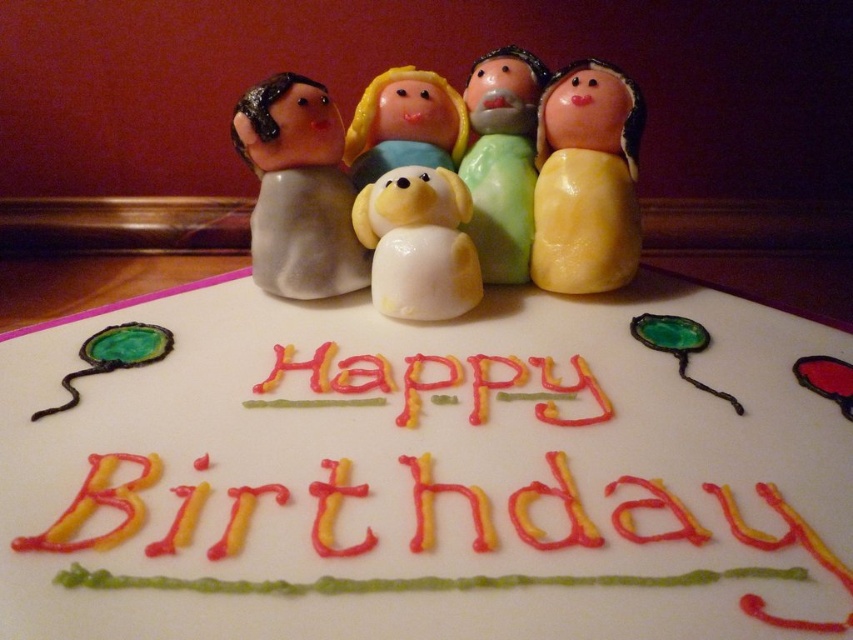
Question: Estimate the real-world distances between objects in this image. Which object is closer to the yellow matte figurine at center?

Choices:
 (A) white glossy dog at center
 (B) yellow icing at center

Answer: (A)

Question: Does yellow matte figurine at center appear under matte green figurine at center?

Choices:
 (A) no
 (B) yes

Answer: (B)

Question: Does white fondant cake at center appear under matte white dog at center?

Choices:
 (A) yes
 (B) no

Answer: (A)

Question: Which point is closer to the camera?

Choices:
 (A) (401, 236)
 (B) (56, 624)
 (C) (279, 360)
 (D) (496, 177)

Answer: (B)

Question: Which is farther from the matte white dog at center?

Choices:
 (A) matte gray figurine at left
 (B) yellow icing at center
 (C) yellow matte figurine at center
 (D) white fondant cake at center

Answer: (D)

Question: Can you confirm if matte gray figurine at left is positioned below yellow icing at center?

Choices:
 (A) yes
 (B) no

Answer: (B)